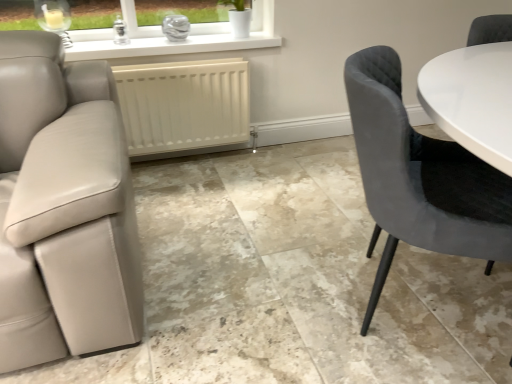
The width and height of the screenshot is (512, 384). In order to click on free space behind velvet grey chair at right in this screenshot , I will do (x=324, y=216).